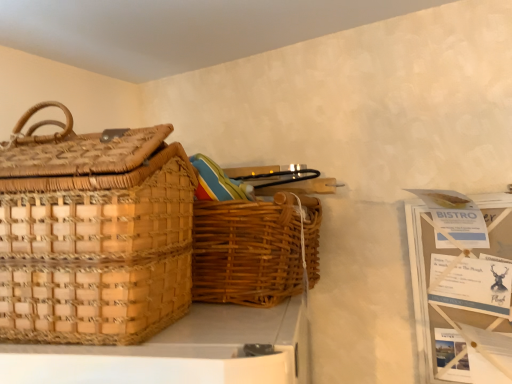
Question: From the image's perspective, is woven brown picnic basket at center, marked as the 1th picnic basket in a right-to-left arrangement, located above or below woven natural picnic basket at left, which is the 1th picnic basket from left to right?

Choices:
 (A) below
 (B) above

Answer: (A)

Question: Does point (197, 243) appear closer or farther from the camera than point (96, 147)?

Choices:
 (A) farther
 (B) closer

Answer: (A)

Question: From a real-world perspective, is woven brown picnic basket at center, arranged as the 2th picnic basket when viewed from the left, above or below woven natural picnic basket at left, which is the 1th picnic basket from left to right?

Choices:
 (A) below
 (B) above

Answer: (A)

Question: Is woven natural picnic basket at left, the second picnic basket when ordered from right to left, wider or thinner than woven brown picnic basket at center, marked as the 1th picnic basket in a right-to-left arrangement?

Choices:
 (A) wide
 (B) thin

Answer: (B)

Question: From a real-world perspective, is woven natural picnic basket at left, the second picnic basket when ordered from right to left, physically located above or below woven brown picnic basket at center, marked as the 1th picnic basket in a right-to-left arrangement?

Choices:
 (A) above
 (B) below

Answer: (A)

Question: Does point (96, 183) appear closer or farther from the camera than point (210, 292)?

Choices:
 (A) closer
 (B) farther

Answer: (A)

Question: From their relative heights in the image, would you say woven natural picnic basket at left, which is the 1th picnic basket from left to right, is taller or shorter than woven brown picnic basket at center, marked as the 1th picnic basket in a right-to-left arrangement?

Choices:
 (A) tall
 (B) short

Answer: (A)